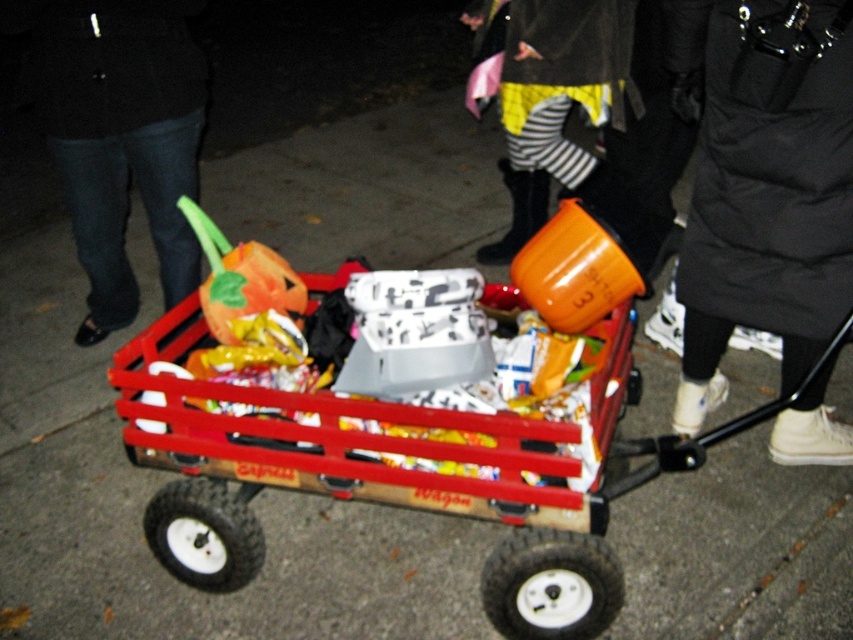
Question: Is the position of black puffy coat at upper right less distant than that of brushed metal pants at lower left?

Choices:
 (A) yes
 (B) no

Answer: (A)

Question: Which is farther from the black puffy coat at upper right?

Choices:
 (A) brushed metal pants at lower left
 (B) striped fabric pants at center

Answer: (A)

Question: Which of the following is the closest to the observer?

Choices:
 (A) black puffy coat at upper right
 (B) striped fabric pants at center
 (C) brushed metal pants at lower left

Answer: (A)

Question: Which point is farther from the camera taking this photo?

Choices:
 (A) (570, 51)
 (B) (752, 131)
 (C) (178, 108)

Answer: (A)

Question: Can you confirm if brushed metal pants at lower left is positioned to the right of striped fabric pants at center?

Choices:
 (A) no
 (B) yes

Answer: (A)

Question: In this image, where is black puffy coat at upper right located relative to brushed metal pants at lower left?

Choices:
 (A) above
 (B) below

Answer: (B)